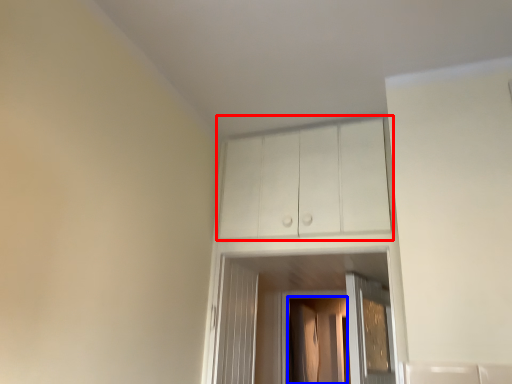
Question: Which object appears farthest to the camera in this image, cabinetry (highlighted by a red box) or screen door (highlighted by a blue box)?

Choices:
 (A) cabinetry
 (B) screen door

Answer: (B)